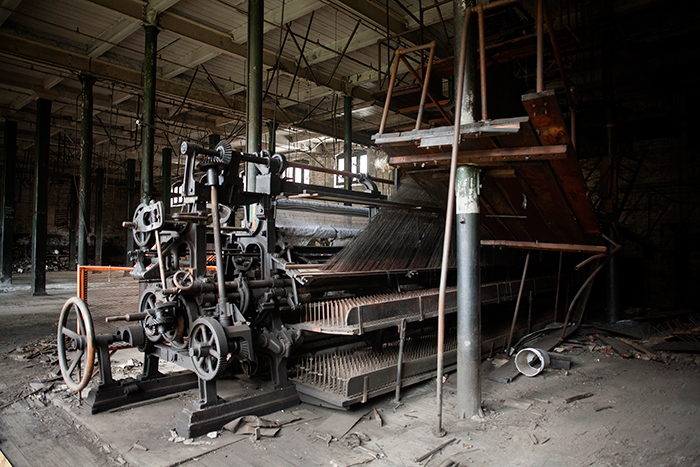
This screenshot has width=700, height=467. Identify the location of ceiling. (199, 74).